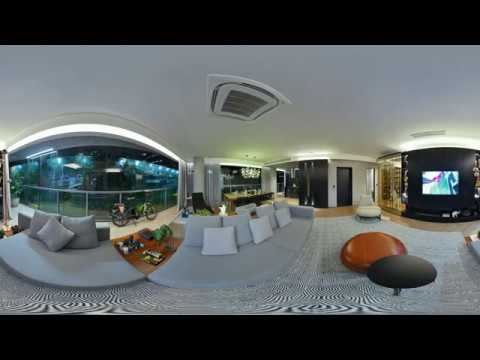
You are a GUI agent. You are given a task and a screenshot of the screen. Output one action in this format:
    pyautogui.click(x=<x>, y=<y>)
    Task: Click on the vent
    
    Given the screenshot: What is the action you would take?
    click(233, 98)